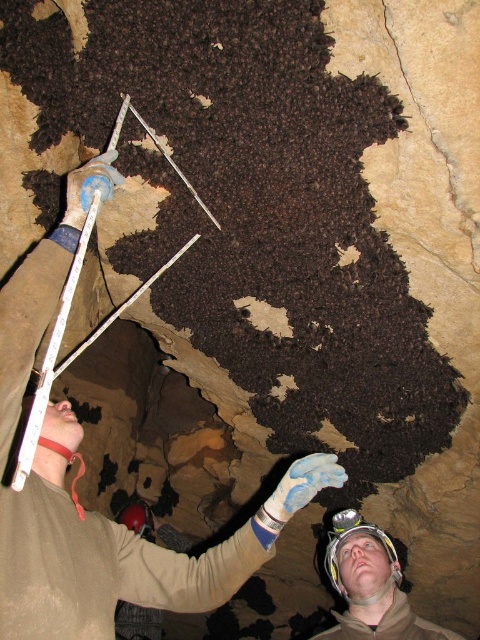
Which is above, tan leather glove at upper center or white hard hat at center?

Positioned higher is tan leather glove at upper center.

Who is positioned more to the left, tan leather glove at upper center or white hard hat at center?

From the viewer's perspective, tan leather glove at upper center appears more on the left side.

Who is more forward, [48,404] or [344,580]?

Positioned in front is point [48,404].

Locate an element on the screen. tan leather glove at upper center is located at coordinates (123, 556).